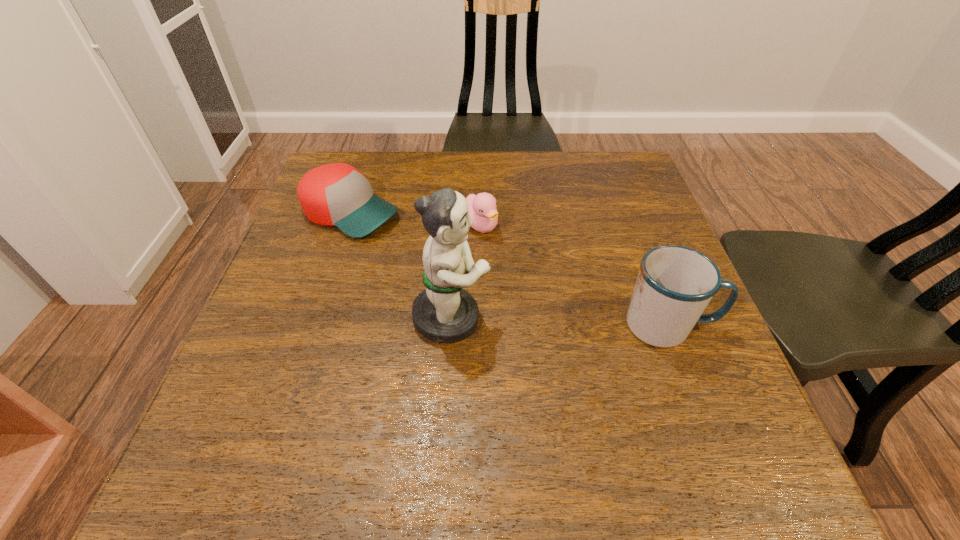
Where is `vacant space at the near left corner of the desktop`? The height and width of the screenshot is (540, 960). vacant space at the near left corner of the desktop is located at coordinates (297, 421).

Locate an element on the screen. The image size is (960, 540). vacant space at the far right corner of the desktop is located at coordinates (613, 154).

This screenshot has height=540, width=960. I want to click on vacant area that lies between the baseball cap and the third shortest object, so click(510, 269).

This screenshot has width=960, height=540. In order to click on free spot between the second tallest object and the tallest object in this screenshot , I will do `click(560, 321)`.

Image resolution: width=960 pixels, height=540 pixels. In order to click on vacant space that's between the duckling and the mug in this screenshot , I will do `click(574, 275)`.

The width and height of the screenshot is (960, 540). Find the location of `free area in between the mug and the duckling`. free area in between the mug and the duckling is located at coordinates point(574,275).

The height and width of the screenshot is (540, 960). Identify the location of free point between the figurine and the leftmost object. (400, 266).

The height and width of the screenshot is (540, 960). I want to click on empty space that is in between the rightmost object and the baseball cap, so click(510, 269).

What are the coordinates of `free spot between the mug and the tallest object` in the screenshot? It's located at (560, 321).

Locate an element on the screen. unoccupied area between the duckling and the third shortest object is located at coordinates (574, 275).